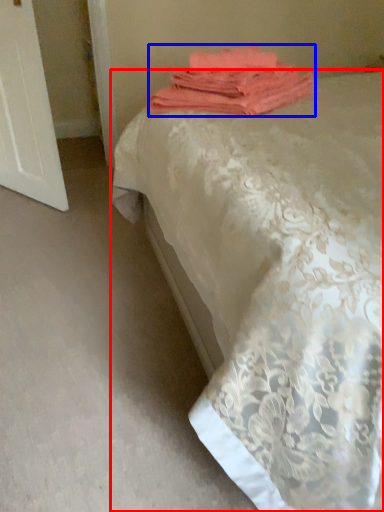
Question: Which of the following is the farthest to the observer, bed (highlighted by a red box) or towel (highlighted by a blue box)?

Choices:
 (A) bed
 (B) towel

Answer: (B)